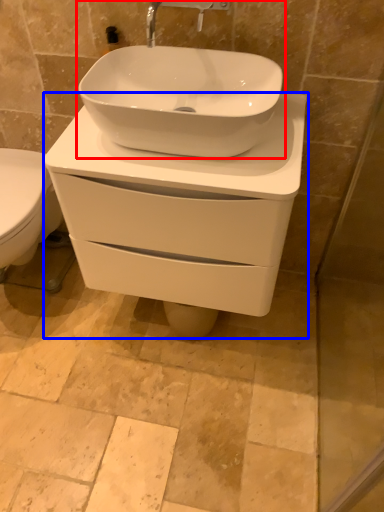
Question: Among these objects, which one is farthest to the camera, sink (highlighted by a red box) or porcelain (highlighted by a blue box)?

Choices:
 (A) sink
 (B) porcelain

Answer: (B)